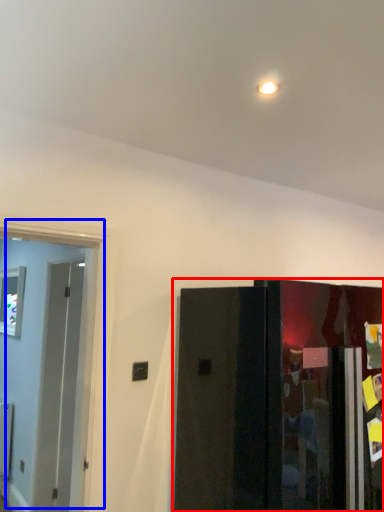
Question: Which point is further to the camera, door (highlighted by a red box) or door (highlighted by a blue box)?

Choices:
 (A) door
 (B) door

Answer: (B)